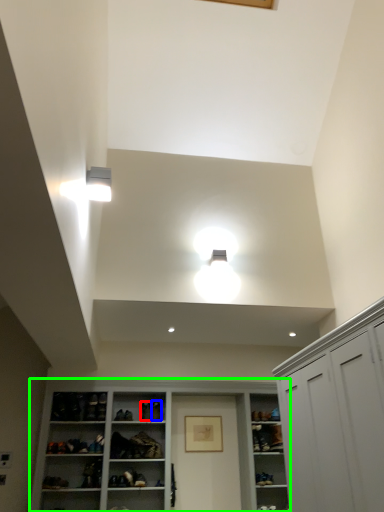
Question: Which object is the closest to the shoe (highlighted by a red box)? Choose among these: shoe (highlighted by a blue box) or cupboard (highlighted by a green box).

Choices:
 (A) shoe
 (B) cupboard

Answer: (A)